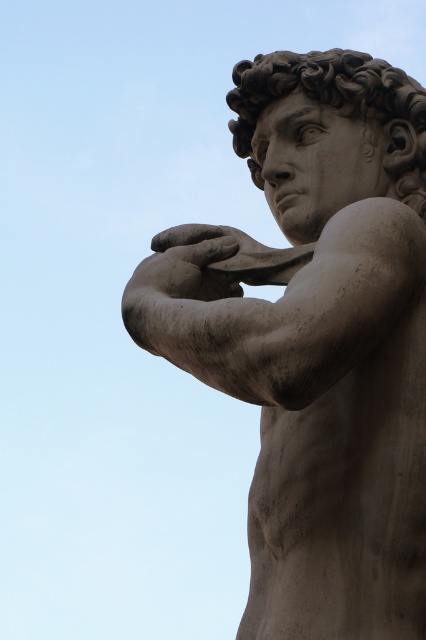
Question: Which point is closer to the camera?

Choices:
 (A) (250, 584)
 (B) (284, 68)
 (C) (229, 291)

Answer: (C)

Question: From the image, what is the correct spatial relationship of stone statue at center in relation to smooth stone head at center?

Choices:
 (A) right
 (B) left

Answer: (B)

Question: Can you confirm if smooth stone head at center is wider than matte stone hand at center?

Choices:
 (A) yes
 (B) no

Answer: (A)

Question: Which object is closer to the camera taking this photo?

Choices:
 (A) matte stone hand at center
 (B) stone statue at center

Answer: (B)

Question: Does smooth stone head at center have a greater width compared to matte stone hand at center?

Choices:
 (A) yes
 (B) no

Answer: (A)

Question: Among these points, which one is nearest to the camera?

Choices:
 (A) (149, 257)
 (B) (365, 86)

Answer: (A)